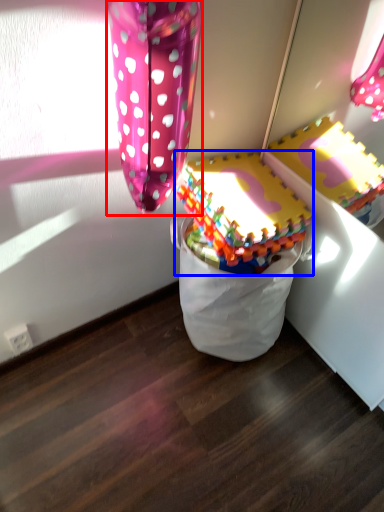
Question: Which of the following is the closest to the observer, balloon (highlighted by a red box) or toy (highlighted by a blue box)?

Choices:
 (A) balloon
 (B) toy

Answer: (A)